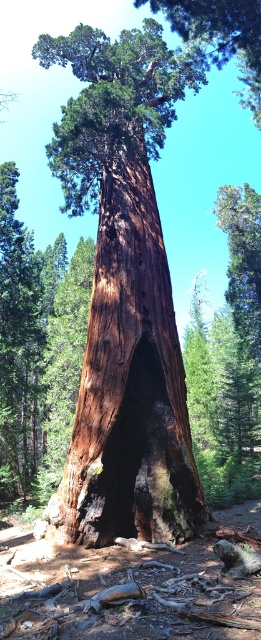
Question: Which point is farther from the camera taking this photo?

Choices:
 (A) (240, 74)
 (B) (80, 488)

Answer: (A)

Question: Can you confirm if brown rough bark at center is positioned above smooth brown bark at upper center?

Choices:
 (A) no
 (B) yes

Answer: (A)

Question: Is brown rough bark at center further to the viewer compared to smooth brown bark at upper center?

Choices:
 (A) no
 (B) yes

Answer: (A)

Question: Is the position of brown rough bark at center more distant than that of smooth brown bark at upper center?

Choices:
 (A) no
 (B) yes

Answer: (A)